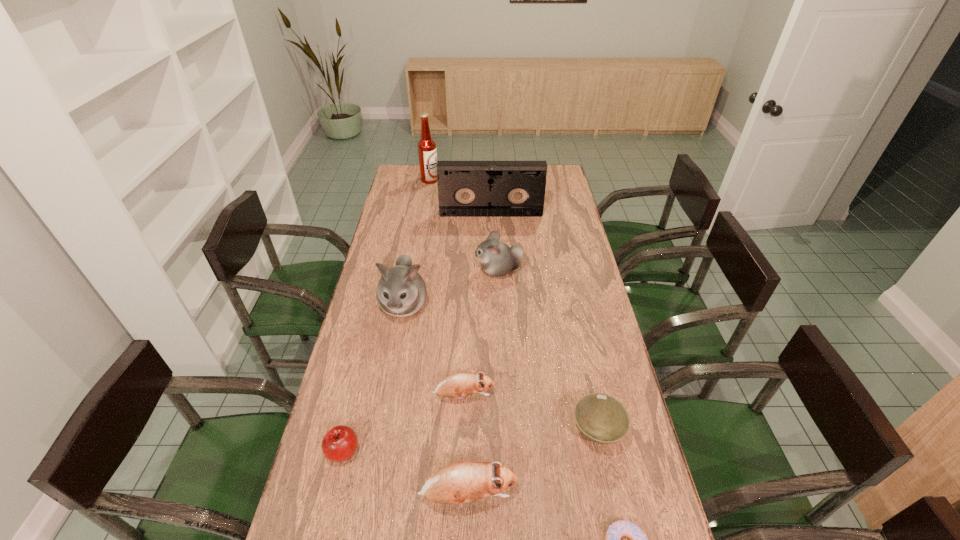
Locate an element on the screen. The width and height of the screenshot is (960, 540). free space between the pink apple and the red alcohol is located at coordinates (386, 315).

The height and width of the screenshot is (540, 960). Find the location of `free space between the third nearest hamster and the red alcohol`. free space between the third nearest hamster and the red alcohol is located at coordinates (417, 242).

Locate an element on the screen. object that ranks as the third closest to the sixth shortest object is located at coordinates (457, 385).

In order to click on object that can be found as the sixth closest to the black videotape in this screenshot , I will do `click(340, 442)`.

Image resolution: width=960 pixels, height=540 pixels. What are the coordinates of `the third closest hamster to the nearest object` in the screenshot? It's located at (401, 292).

Identify which hamster is the fourth closest to the bowl. Please provide its 2D coordinates. Your answer should be formatted as a tuple, i.e. [(x, y)], where the tuple contains the x and y coordinates of a point satisfying the conditions above.

[(497, 259)]

You are a GUI agent. You are given a task and a screenshot of the screen. Output one action in this format:
    pyautogui.click(x=<x>, y=<y>)
    Task: Click on the free space that satisfies the following two spatial constraints: 1. on the label side of the red alcohol; 2. on the face of the third nearest hamster
    Image resolution: width=960 pixels, height=540 pixels.
    Given the screenshot: What is the action you would take?
    pos(409,305)

The image size is (960, 540). Find the location of `free region that satisfies the following two spatial constraints: 1. on the face of the fourth farthest object; 2. on the right side of the bowl`. free region that satisfies the following two spatial constraints: 1. on the face of the fourth farthest object; 2. on the right side of the bowl is located at coordinates (381, 431).

I want to click on blank area in the image that satisfies the following two spatial constraints: 1. on the label side of the alcohol; 2. on the right side of the bowl, so click(x=388, y=431).

The height and width of the screenshot is (540, 960). Find the location of `vacant position in the image that satisfies the following two spatial constraints: 1. on the back side of the gray bowl; 2. on the face of the smaller white hamster`. vacant position in the image that satisfies the following two spatial constraints: 1. on the back side of the gray bowl; 2. on the face of the smaller white hamster is located at coordinates (563, 271).